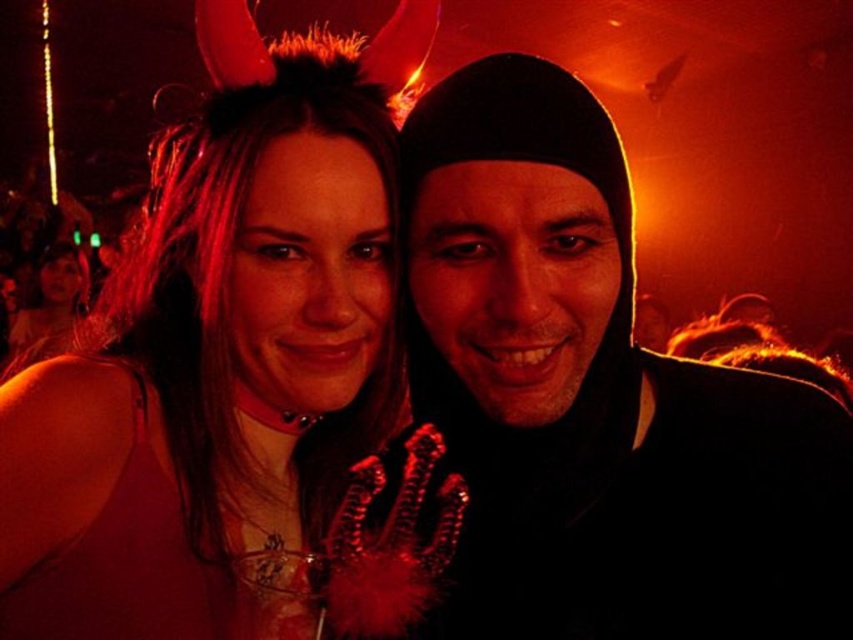
You are at a party and want to know which object is shorter between the black matte beanie at center and the matte black hair at center. Can you tell me?

The black matte beanie at center has a lesser height compared to the matte black hair at center, so the black matte beanie at center is shorter.